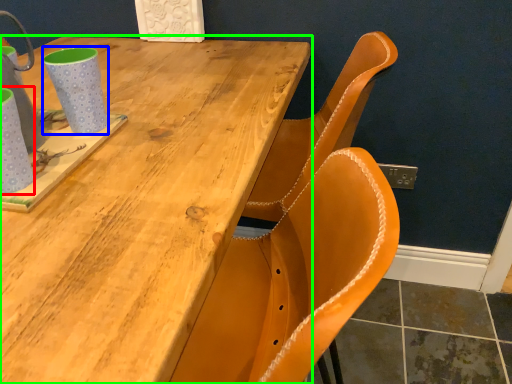
Question: Estimate the real-world distances between objects in this image. Which object is farther from mug (highlighted by a red box), mug (highlighted by a blue box) or table (highlighted by a green box)?

Choices:
 (A) mug
 (B) table

Answer: (B)